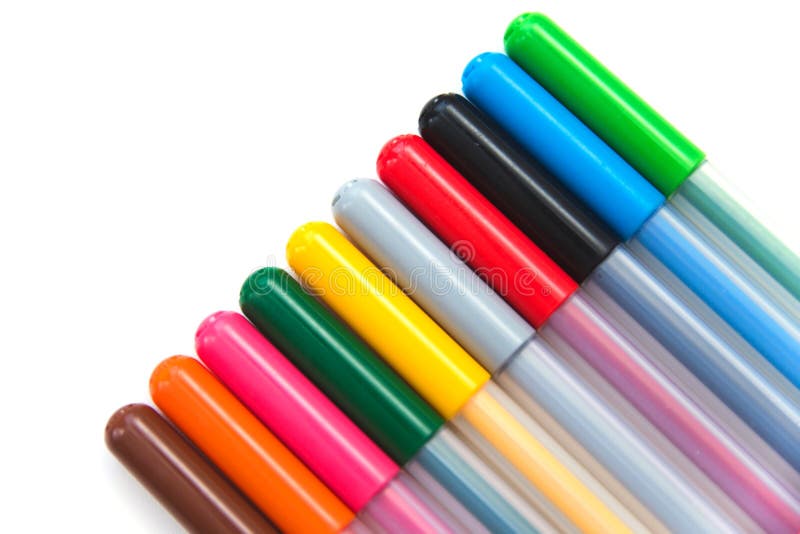
Where is `pen caps`? The image size is (800, 534). pen caps is located at coordinates (194, 484), (225, 442), (262, 394), (334, 356), (385, 320), (453, 287), (486, 233), (514, 193), (557, 146), (622, 115).